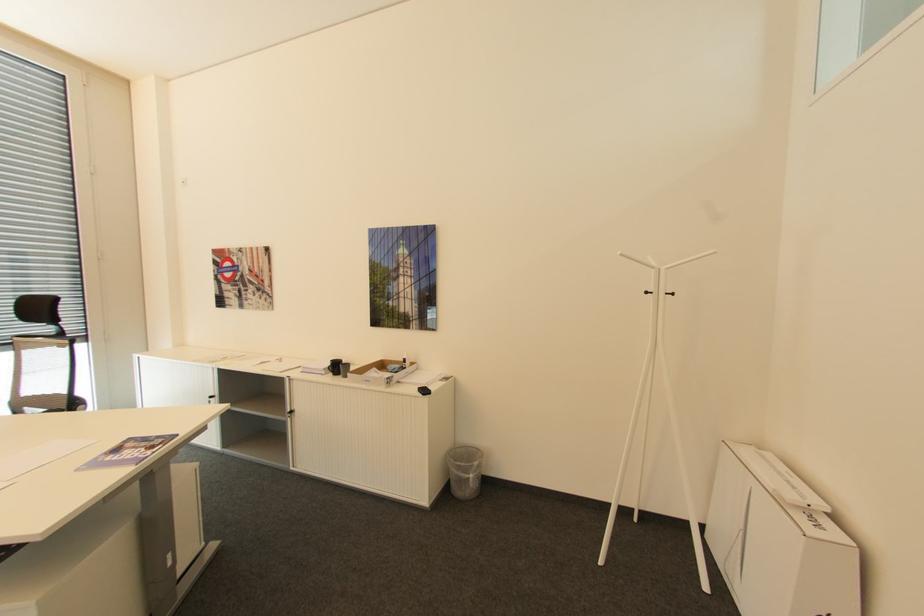
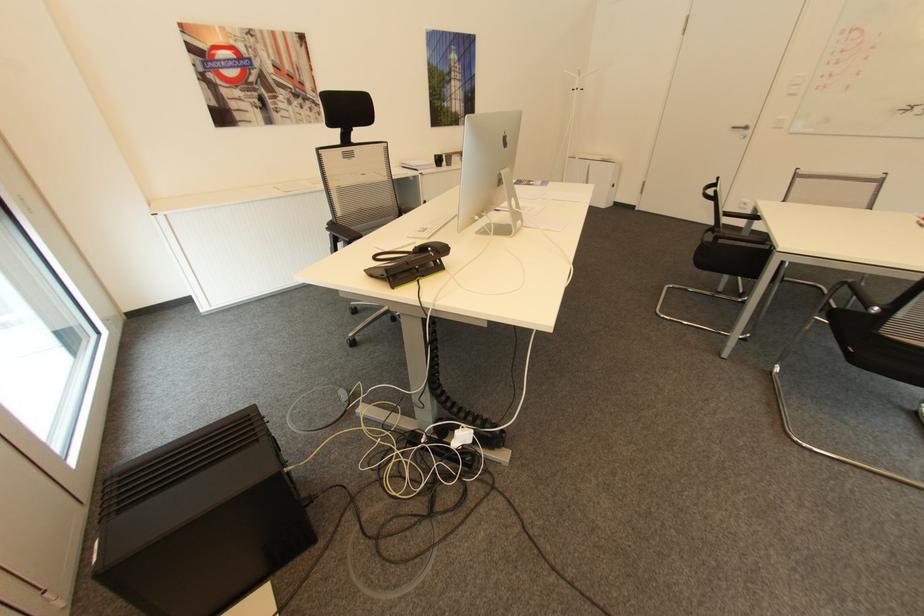
Locate, in the second image, the point that corresponds to pixel 336 360 in the first image.

(441, 155)